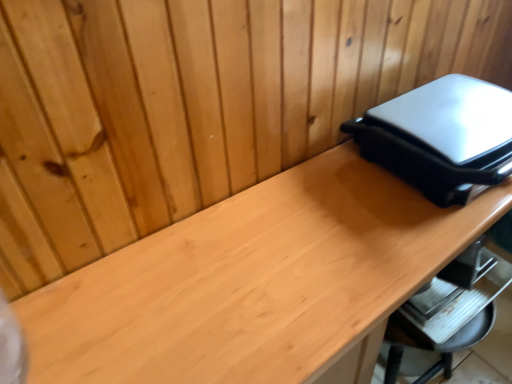
The width and height of the screenshot is (512, 384). I want to click on free spot above matte wood desk at right (from a real-world perspective), so click(302, 260).